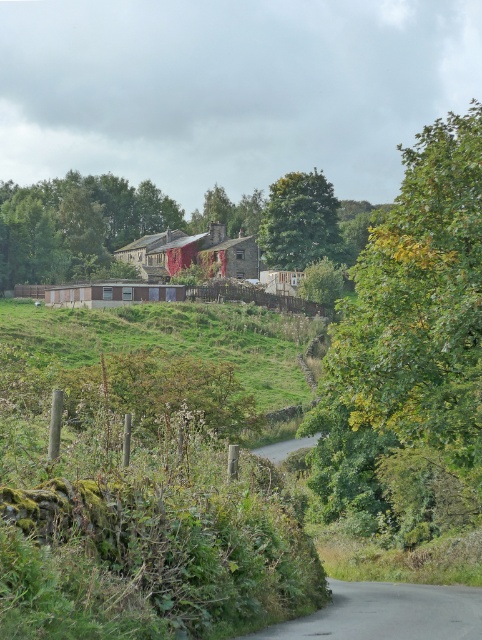
You are a hiker standing at the start of the narrow road in the foreground. You want to reach the green grassy hillside at center. Which direction should you walk to avoid the green leafy tree at upper right?

To reach the green grassy hillside at center while avoiding the green leafy tree at upper right, you should walk along the narrow road towards the center of the image, as the tree is positioned to the upper right and the hillside is centrally located. This path keeps you away from the tree.

You are a hiker standing at the base of the green grassy hillside at center and want to reach the top of the green leafy tree at upper right. Which direction should you move to get closer to the tree?

You should move towards the upper right direction to get closer to the green leafy tree at upper right since it is located in that direction.